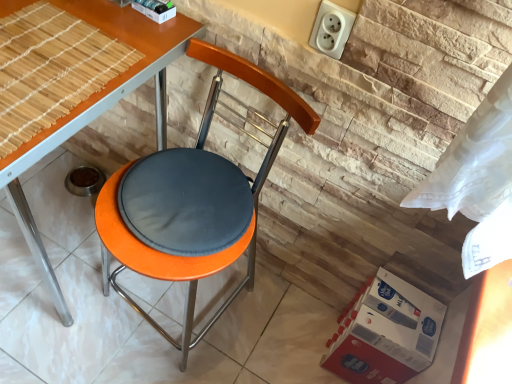
Find the location of a particular element. empty space that is ontop of red cardboard box at lower right (from a real-world perspective) is located at coordinates (410, 320).